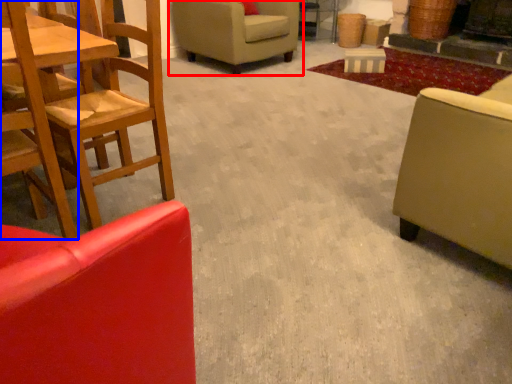
Question: Which object appears farthest to the camera in this image, chair (highlighted by a red box) or chair (highlighted by a blue box)?

Choices:
 (A) chair
 (B) chair

Answer: (A)